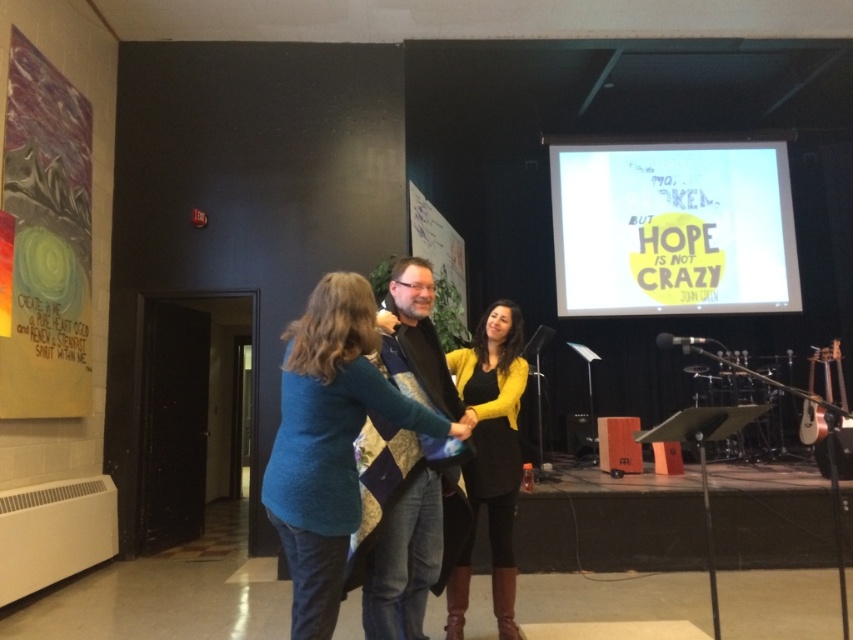
You are an event planner organizing a community event. You need to decide which item, the white paper at upper center or the quilted fabric vest at center, can be used as a backdrop for a speech. Based on their sizes, which one would be more suitable for covering a larger area behind the speaker?

The white paper at upper center is larger in size than the quilted fabric vest at center, making it more suitable for covering a larger area behind the speaker.

Looking at this image, where is the quilted fabric vest at center located in the image?

The quilted fabric vest at center is located at point (x=410, y=554) in the image.

You are an event planner setting up for a presentation. You need to ensure that the yellow knit cardigan at center is visible to the audience. Given that the white paper at upper center is currently blocking its view, what adjustment should you make?

The yellow knit cardigan at center is behind the white paper at upper center, so to make the yellow knit cardigan at center visible, move the white paper at upper center to a different position or lower its height so it no longer blocks the view of the yellow knit cardigan at center.